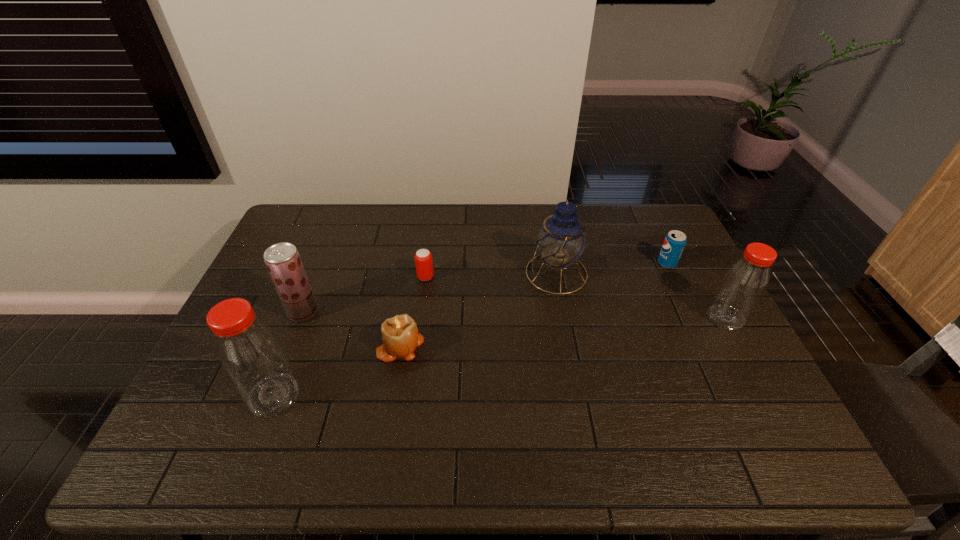
This screenshot has width=960, height=540. I want to click on free location located on the back of the farther bottle, so click(x=708, y=286).

Identify the location of vacant space located 0.300m on the back of the soda can. The image size is (960, 540). (640, 206).

Find the location of a particular element. The height and width of the screenshot is (540, 960). vacant region located 0.370m on the left of the shortest object is located at coordinates (300, 277).

The height and width of the screenshot is (540, 960). Find the location of `vacant space situated 0.290m on the left of the candle`. vacant space situated 0.290m on the left of the candle is located at coordinates (269, 346).

What are the coordinates of `vacant space located 0.110m on the front-facing side of the lantern` in the screenshot? It's located at (492, 273).

Where is `free space located on the front-facing side of the lantern`? The width and height of the screenshot is (960, 540). free space located on the front-facing side of the lantern is located at coordinates (413, 273).

Find the location of `vacant space located on the front-facing side of the lantern`. vacant space located on the front-facing side of the lantern is located at coordinates (478, 273).

What are the coordinates of `vacant space situated 0.100m on the right of the fruit juice` in the screenshot? It's located at (352, 312).

Where is `object situated at the near edge`? This screenshot has height=540, width=960. object situated at the near edge is located at coordinates (248, 350).

Locate an element on the screen. bottle that is at the left edge is located at coordinates (248, 350).